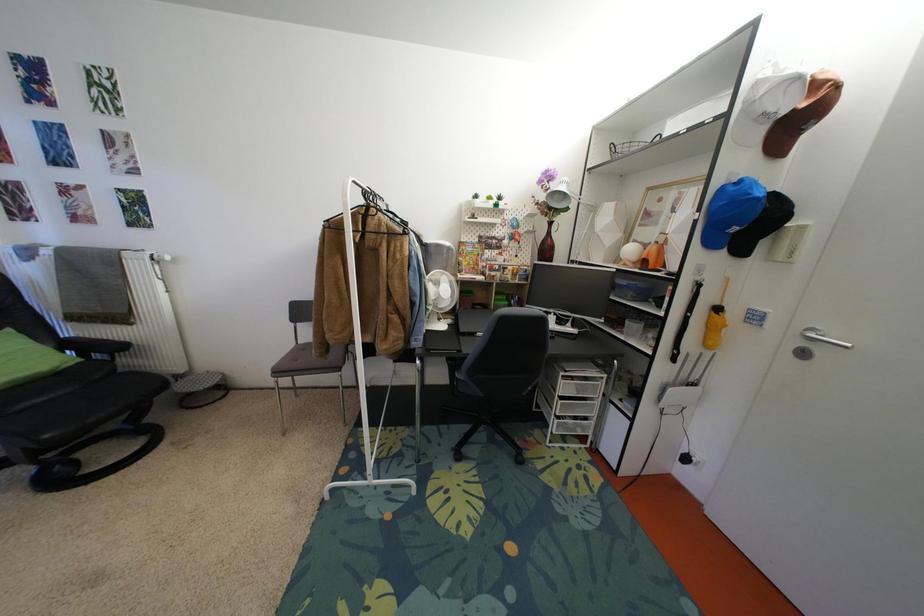
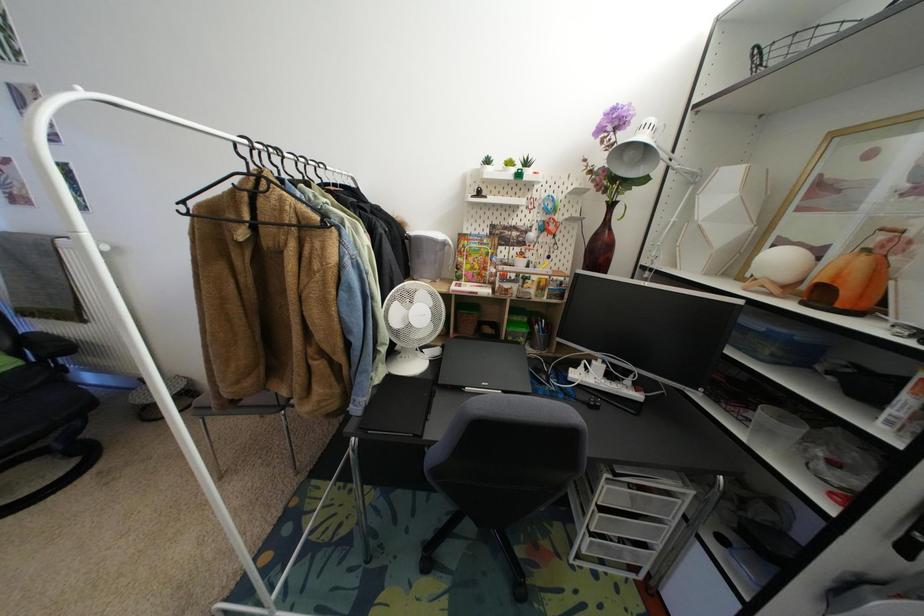
Question: Which direction would the cameraman need to move to produce the second image? Reply with the corresponding letter.

Choices:
 (A) Left
 (B) Right
 (C) Forward
 (D) Backward

Answer: (C)